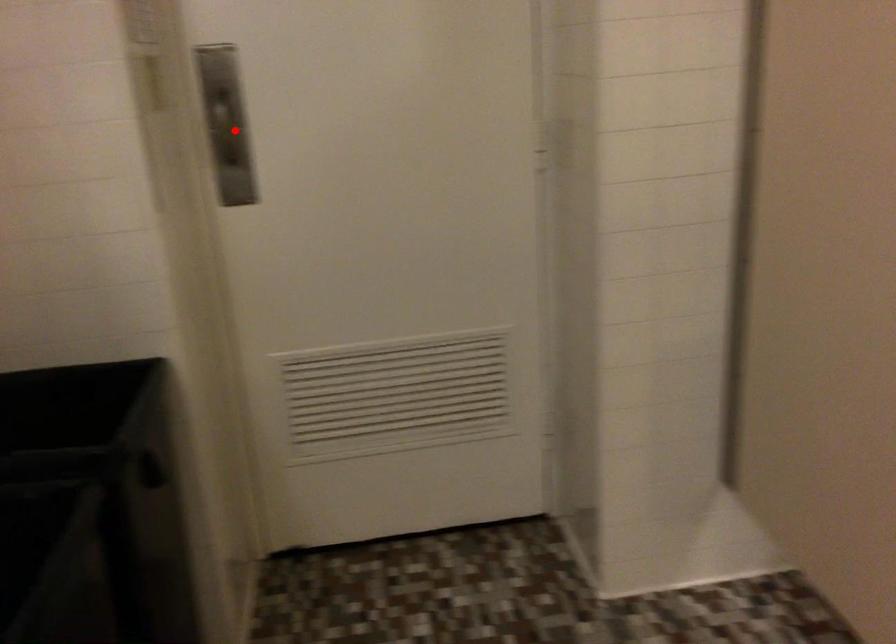
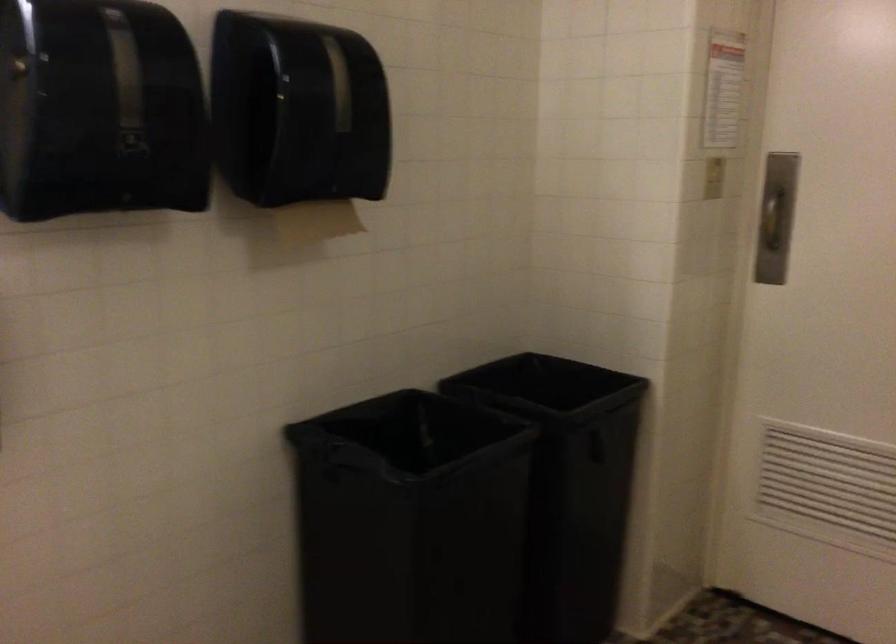
Question: I am providing you with two images of the same scene from different viewpoints. Image1 has a red point marked. In image2, the corresponding 3D location appears at what relative position? Reply with the corresponding letter.

Choices:
 (A) Closer
 (B) Farther

Answer: (B)